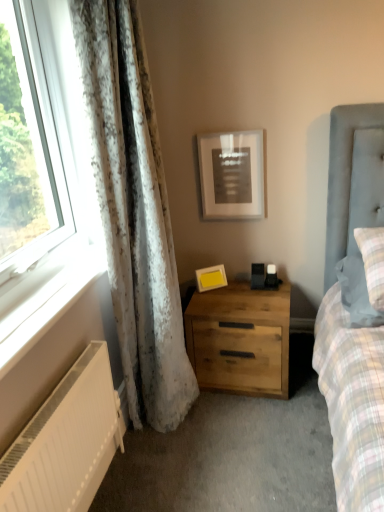
The image size is (384, 512). What do you see at coordinates (356, 293) in the screenshot?
I see `plaid fabric pillow at right` at bounding box center [356, 293].

Locate an element on the screen. white matte radiator at lower left is located at coordinates (66, 441).

At what (x,y) coordinates should I click in order to perform the action: click on plaid fabric pillow at right. Please return your answer as a coordinate pair (x, y). The image size is (384, 512). Looking at the image, I should click on (356, 293).

What's the angular difference between plaid fabric pillow at right and white matte radiator at lower left's facing directions?

89.1 degrees separate the facing orientations of plaid fabric pillow at right and white matte radiator at lower left.

Which is behind, point (339, 263) or point (11, 492)?

The point (339, 263) is more distant.

Does plaid fabric pillow at right lie behind white matte radiator at lower left?

Yes, it is behind white matte radiator at lower left.

Who is smaller, matte black picture frame at upper center, the second picture frame ordered from the bottom, or plaid fabric pillow at right?

Smaller between the two is matte black picture frame at upper center, the second picture frame ordered from the bottom.

Is matte black picture frame at upper center, acting as the first picture frame starting from the top, oriented away from plaid fabric pillow at right?

No, matte black picture frame at upper center, acting as the first picture frame starting from the top, is not facing the opposite direction of plaid fabric pillow at right.

Which object is further away from the camera, matte black picture frame at upper center, the second picture frame ordered from the bottom, or plaid fabric pillow at right?

Positioned behind is matte black picture frame at upper center, the second picture frame ordered from the bottom.

From a real-world perspective, is white textured curtain at left on plaid fabric pillow at right?

Yes.

Is white textured curtain at left smaller than plaid fabric pillow at right?

Actually, white textured curtain at left might be larger than plaid fabric pillow at right.

What's the angular difference between white textured curtain at left and plaid fabric pillow at right's facing directions?

The facing directions of white textured curtain at left and plaid fabric pillow at right are 88.2 degrees apart.

Is white textured curtain at left positioned behind plaid fabric pillow at right?

No, white textured curtain at left is closer to the viewer.

Is plaid fabric pillow at right aimed at white textured curtain at left?

No, plaid fabric pillow at right is not oriented towards white textured curtain at left.

Between plaid fabric pillow at right and white textured curtain at left, which one has less height?

→ Standing shorter between the two is plaid fabric pillow at right.

Where is `pillow directly beneath the white textured curtain at left (from a real-world perspective)`? The width and height of the screenshot is (384, 512). pillow directly beneath the white textured curtain at left (from a real-world perspective) is located at coordinates (356, 293).

Considering the points (364, 274) and (96, 91), which point is in front, point (364, 274) or point (96, 91)?

The point (96, 91) is more forward.

Which of these two, natural wood nightstand at center or plaid fabric pillow at right, is smaller?

Smaller between the two is plaid fabric pillow at right.

Can you tell me how much natural wood nightstand at center and plaid fabric pillow at right differ in facing direction?

There is a 1.8-degree angle between the facing directions of natural wood nightstand at center and plaid fabric pillow at right.

From the image's perspective, which object appears higher, natural wood nightstand at center or plaid fabric pillow at right?

From the image's view, plaid fabric pillow at right is above.

Measure the distance between natural wood nightstand at center and plaid fabric pillow at right.

natural wood nightstand at center and plaid fabric pillow at right are 51.26 centimeters apart.

Does natural wood nightstand at center turn towards white textured curtain at left?

No, natural wood nightstand at center is not oriented towards white textured curtain at left.

Based on the photo, between natural wood nightstand at center and white textured curtain at left, which one is positioned in front?

white textured curtain at left is more forward.

In the image, is natural wood nightstand at center on the left side or the right side of white textured curtain at left?

natural wood nightstand at center is to the right of white textured curtain at left.

Which is less distant, (x=197, y=304) or (x=177, y=369)?

Point (x=197, y=304).

Is yellow matte picture frame at upper center, the 2th picture frame when ordered from top to bottom, turned away from white painted wood at lower left?

No, yellow matte picture frame at upper center, the 2th picture frame when ordered from top to bottom, is not facing the opposite direction of white painted wood at lower left.

Is yellow matte picture frame at upper center, the 2th picture frame when ordered from top to bottom, far away from white painted wood at lower left?

No, yellow matte picture frame at upper center, the 2th picture frame when ordered from top to bottom, is in close proximity to white painted wood at lower left.

From the image's perspective, between yellow matte picture frame at upper center, the 1th picture frame positioned from the bottom, and white painted wood at lower left, who is located below?

From the image's view, white painted wood at lower left is below.

Locate an element on the screen. This screenshot has width=384, height=512. radiator below the plaid fabric pillow at right (from a real-world perspective) is located at coordinates [66, 441].

Which picture frame is the 1st one when counting from the back of the plaid fabric pillow at right? Please provide its 2D coordinates.

[(233, 175)]

Estimate the real-world distances between objects in this image. Which object is closer to natural wood nightstand at center, yellow matte picture frame at upper center, the 2th picture frame when ordered from top to bottom, or white painted wood at lower left?

Among the two, yellow matte picture frame at upper center, the 2th picture frame when ordered from top to bottom, is located nearer to natural wood nightstand at center.

Which object lies nearer to the anchor point yellow matte picture frame at upper center, the 1th picture frame positioned from the bottom, white textured curtain at left or white matte radiator at lower left?

The object closer to yellow matte picture frame at upper center, the 1th picture frame positioned from the bottom, is white textured curtain at left.

When comparing their distances from white textured curtain at left, does white matte radiator at lower left or yellow matte picture frame at upper center, the 2th picture frame when ordered from top to bottom, seem further?

yellow matte picture frame at upper center, the 2th picture frame when ordered from top to bottom, lies further to white textured curtain at left than the other object.

When comparing their distances from white textured curtain at left, does matte black picture frame at upper center, acting as the first picture frame starting from the top, or yellow matte picture frame at upper center, the 1th picture frame positioned from the bottom, seem closer?

matte black picture frame at upper center, acting as the first picture frame starting from the top.

Considering their positions, is yellow matte picture frame at upper center, the 1th picture frame positioned from the bottom, positioned closer to white painted wood at lower left than white matte radiator at lower left?

white matte radiator at lower left.

Which object lies nearer to the anchor point white matte radiator at lower left, yellow matte picture frame at upper center, the 2th picture frame when ordered from top to bottom, or natural wood nightstand at center?

natural wood nightstand at center lies closer to white matte radiator at lower left than the other object.

When comparing their distances from natural wood nightstand at center, does matte black picture frame at upper center, acting as the first picture frame starting from the top, or white textured curtain at left seem further?

matte black picture frame at upper center, acting as the first picture frame starting from the top, is positioned further to the anchor natural wood nightstand at center.

Based on the photo, based on their spatial positions, is matte black picture frame at upper center, acting as the first picture frame starting from the top, or white textured curtain at left closer to yellow matte picture frame at upper center, the 1th picture frame positioned from the bottom?

matte black picture frame at upper center, acting as the first picture frame starting from the top, is positioned closer to the anchor yellow matte picture frame at upper center, the 1th picture frame positioned from the bottom.

Locate an element on the screen. This screenshot has width=384, height=512. curtain between white painted wood at lower left and yellow matte picture frame at upper center, the 1th picture frame positioned from the bottom, from front to back is located at coordinates (134, 211).

I want to click on window sill between white matte radiator at lower left and natural wood nightstand at center from front to back, so click(46, 317).

This screenshot has width=384, height=512. What are the coordinates of `curtain between white matte radiator at lower left and yellow matte picture frame at upper center, the 1th picture frame positioned from the bottom, in the front-back direction` in the screenshot? It's located at pos(134,211).

This screenshot has width=384, height=512. What are the coordinates of `curtain between matte black picture frame at upper center, the second picture frame ordered from the bottom, and white matte radiator at lower left from top to bottom` in the screenshot? It's located at (134, 211).